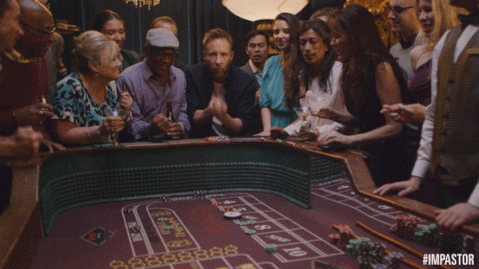
Where is `decorative fake golden tree`? The height and width of the screenshot is (269, 479). decorative fake golden tree is located at coordinates (445, 13).